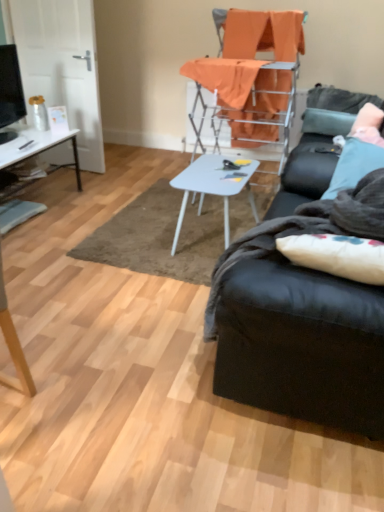
Question: Could you tell me if white soft pillow at right is facing matte black tv at left?

Choices:
 (A) yes
 (B) no

Answer: (A)

Question: Is white soft pillow at right far from matte black tv at left?

Choices:
 (A) no
 (B) yes

Answer: (B)

Question: Is white soft pillow at right to the right of matte black tv at left from the viewer's perspective?

Choices:
 (A) yes
 (B) no

Answer: (A)

Question: Are white soft pillow at right and matte black tv at left beside each other?

Choices:
 (A) yes
 (B) no

Answer: (B)

Question: From the image's perspective, does white soft pillow at right appear lower than matte black tv at left?

Choices:
 (A) no
 (B) yes

Answer: (B)

Question: From a real-world perspective, is white soft pillow at right above or below matte black tv at left?

Choices:
 (A) above
 (B) below

Answer: (B)

Question: Based on their sizes in the image, would you say white soft pillow at right is bigger or smaller than matte black tv at left?

Choices:
 (A) small
 (B) big

Answer: (A)

Question: From the image's perspective, is white soft pillow at right positioned above or below matte black tv at left?

Choices:
 (A) above
 (B) below

Answer: (B)

Question: In the image, is white soft pillow at right on the left side or the right side of matte black tv at left?

Choices:
 (A) left
 (B) right

Answer: (B)

Question: Would you say black leather couch at right is to the left or to the right of orange fabric chair at upper center in the picture?

Choices:
 (A) left
 (B) right

Answer: (B)

Question: From the image's perspective, is black leather couch at right positioned above or below orange fabric chair at upper center?

Choices:
 (A) above
 (B) below

Answer: (B)

Question: Is black leather couch at right wider or thinner than orange fabric chair at upper center?

Choices:
 (A) thin
 (B) wide

Answer: (B)

Question: From a real-world perspective, relative to orange fabric chair at upper center, is black leather couch at right vertically above or below?

Choices:
 (A) above
 (B) below

Answer: (B)

Question: Considering their positions, is orange fabric chair at upper center located in front of or behind matte black tv at left?

Choices:
 (A) behind
 (B) front

Answer: (B)

Question: Based on their sizes in the image, would you say orange fabric chair at upper center is bigger or smaller than matte black tv at left?

Choices:
 (A) big
 (B) small

Answer: (A)